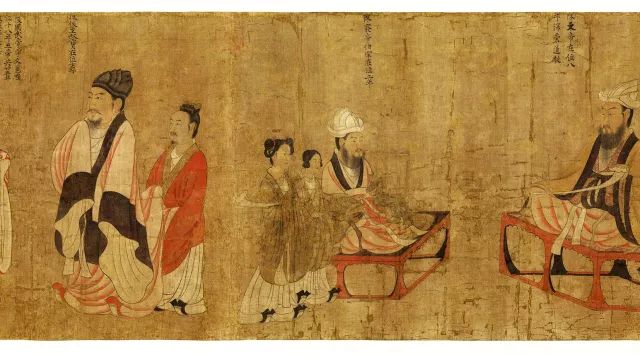
The image size is (640, 355). In order to click on sitting area on right in this screenshot , I will do `click(596, 259)`, `click(508, 216)`.